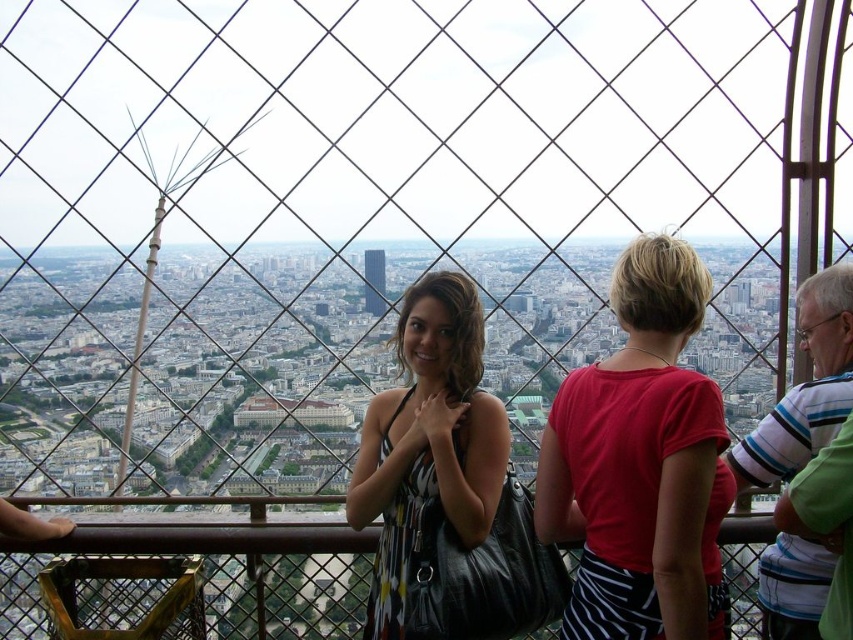
Question: Is red matte shirt at center to the left of brushed metal eiffel tower at left from the viewer's perspective?

Choices:
 (A) no
 (B) yes

Answer: (A)

Question: Is the position of printed fabric dress at center less distant than that of brushed metal eiffel tower at left?

Choices:
 (A) yes
 (B) no

Answer: (A)

Question: Is printed fabric dress at center to the right of brushed metal eiffel tower at left from the viewer's perspective?

Choices:
 (A) no
 (B) yes

Answer: (B)

Question: Which of the following is the closest to the observer?

Choices:
 (A) (653, 419)
 (B) (173, 182)
 (C) (404, 362)

Answer: (A)

Question: Which object appears closest to the camera in this image?

Choices:
 (A) printed fabric dress at center
 (B) brushed metal eiffel tower at left
 (C) red matte shirt at center

Answer: (C)

Question: Which of these objects is positioned farthest from the printed fabric dress at center?

Choices:
 (A) red matte shirt at center
 (B) brushed metal eiffel tower at left

Answer: (B)